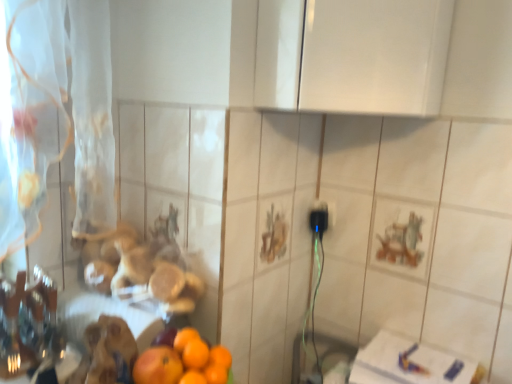
Find the location of a particular element. white sheer curtain at left is located at coordinates (57, 116).

Is orange matte at lower left, marked as the second orange in a left-to-right arrangement, looking in the opposite direction of white sheer curtain at left?

orange matte at lower left, marked as the second orange in a left-to-right arrangement, is not turned away from white sheer curtain at left.

Based on the photo, from the image's perspective, which object appears higher, orange matte at lower left, the first orange viewed from the right, or white sheer curtain at left?

From the image's view, white sheer curtain at left is above.

Which object is more forward, orange matte at lower left, marked as the second orange in a left-to-right arrangement, or white sheer curtain at left?

Positioned in front is white sheer curtain at left.

The image size is (512, 384). In order to click on curtain that appears on the left of orange matte at lower left, the first orange viewed from the right in this screenshot , I will do `click(57, 116)`.

Which object is wider, white sheer curtain at left or orange matte at lower left, acting as the 1th orange starting from the left?

white sheer curtain at left is wider.

Considering the positions of point (92, 84) and point (151, 378), is point (92, 84) closer or farther from the camera than point (151, 378)?

Point (92, 84) is farther from the camera than point (151, 378).

From a real-world perspective, who is located lower, white sheer curtain at left or orange matte at lower left, arranged as the 2th orange when viewed from the right?

From a 3D spatial view, orange matte at lower left, arranged as the 2th orange when viewed from the right, is below.

Consider the image. Is white sheer curtain at left positioned far away from orange matte at lower left, acting as the 1th orange starting from the left?

No, white sheer curtain at left is in close proximity to orange matte at lower left, acting as the 1th orange starting from the left.

Which of these two, orange matte at lower left, arranged as the 2th orange when viewed from the right, or orange matte at lower left, the first orange viewed from the right, stands taller?

Standing taller between the two is orange matte at lower left, arranged as the 2th orange when viewed from the right.

From the image's perspective, is orange matte at lower left, acting as the 1th orange starting from the left, located above or below orange matte at lower left, the first orange viewed from the right?

From the image's perspective, orange matte at lower left, acting as the 1th orange starting from the left, appears below orange matte at lower left, the first orange viewed from the right.

Which object is further away from the camera taking this photo, orange matte at lower left, arranged as the 2th orange when viewed from the right, or orange matte at lower left, marked as the second orange in a left-to-right arrangement?

orange matte at lower left, marked as the second orange in a left-to-right arrangement, is more distant.

Measure the distance between orange matte at lower left, acting as the 1th orange starting from the left, and orange matte at lower left, the first orange viewed from the right.

2.18 inches.

Is point (188, 352) closer or farther from the camera than point (160, 374)?

Point (188, 352) is positioned farther from the camera compared to point (160, 374).

Is orange matte at lower left, marked as the second orange in a left-to-right arrangement, facing towards orange matte at lower left, acting as the 1th orange starting from the left?

No, orange matte at lower left, marked as the second orange in a left-to-right arrangement, does not turn towards orange matte at lower left, acting as the 1th orange starting from the left.

Which object is positioned more to the right, orange matte at lower left, the first orange viewed from the right, or orange matte at lower left, acting as the 1th orange starting from the left?

Positioned to the right is orange matte at lower left, the first orange viewed from the right.

Can you confirm if orange matte at lower left, acting as the 1th orange starting from the left, is smaller than white sheer curtain at left?

Correct, orange matte at lower left, acting as the 1th orange starting from the left, occupies less space than white sheer curtain at left.

Between orange matte at lower left, arranged as the 2th orange when viewed from the right, and white sheer curtain at left, which one has smaller width?

orange matte at lower left, arranged as the 2th orange when viewed from the right.

From the image's perspective, is orange matte at lower left, acting as the 1th orange starting from the left, beneath white sheer curtain at left?

Indeed, from the image's perspective, orange matte at lower left, acting as the 1th orange starting from the left, is shown beneath white sheer curtain at left.

From a real-world perspective, is orange matte at lower left, arranged as the 2th orange when viewed from the right, positioned above or below white sheer curtain at left?

From a real-world perspective, orange matte at lower left, arranged as the 2th orange when viewed from the right, is physically below white sheer curtain at left.

Would you say white sheer curtain at left is outside orange matte at lower left, marked as the second orange in a left-to-right arrangement?

Yes, white sheer curtain at left is located beyond the bounds of orange matte at lower left, marked as the second orange in a left-to-right arrangement.

Is orange matte at lower left, the first orange viewed from the right, at the back of white sheer curtain at left?

No, white sheer curtain at left is not facing the opposite direction of orange matte at lower left, the first orange viewed from the right.

Is white sheer curtain at left directly adjacent to orange matte at lower left, marked as the second orange in a left-to-right arrangement?

No, white sheer curtain at left is not touching orange matte at lower left, marked as the second orange in a left-to-right arrangement.

Find the location of a particular element. curtain on the left of the orange matte at lower left, the first orange viewed from the right is located at coordinates coord(57,116).

Locate an element on the screen. Image resolution: width=512 pixels, height=384 pixels. the 1st orange behind the white sheer curtain at left, counting from the anchor's position is located at coordinates click(158, 366).

Which object lies further to the anchor point orange matte at lower left, arranged as the 2th orange when viewed from the right, orange matte at lower left, the first orange viewed from the right, or white sheer curtain at left?

Among the two, white sheer curtain at left is located further to orange matte at lower left, arranged as the 2th orange when viewed from the right.

Looking at the image, which one is located closer to orange matte at lower left, acting as the 1th orange starting from the left, white sheer curtain at left or orange matte at lower left, the first orange viewed from the right?

orange matte at lower left, the first orange viewed from the right.

Based on their spatial positions, is orange matte at lower left, acting as the 1th orange starting from the left, or white sheer curtain at left further from orange matte at lower left, marked as the second orange in a left-to-right arrangement?

Among the two, white sheer curtain at left is located further to orange matte at lower left, marked as the second orange in a left-to-right arrangement.

When comparing their distances from orange matte at lower left, the first orange viewed from the right, does white sheer curtain at left or orange matte at lower left, arranged as the 2th orange when viewed from the right, seem further?

white sheer curtain at left is further to orange matte at lower left, the first orange viewed from the right.

When comparing their distances from white sheer curtain at left, does orange matte at lower left, marked as the second orange in a left-to-right arrangement, or orange matte at lower left, arranged as the 2th orange when viewed from the right, seem closer?

The object closer to white sheer curtain at left is orange matte at lower left, arranged as the 2th orange when viewed from the right.

Considering their positions, is orange matte at lower left, arranged as the 2th orange when viewed from the right, positioned closer to white sheer curtain at left than orange matte at lower left, marked as the second orange in a left-to-right arrangement?

orange matte at lower left, arranged as the 2th orange when viewed from the right.

The width and height of the screenshot is (512, 384). I want to click on orange between white sheer curtain at left and orange matte at lower left, arranged as the 2th orange when viewed from the right, from top to bottom, so click(x=195, y=354).